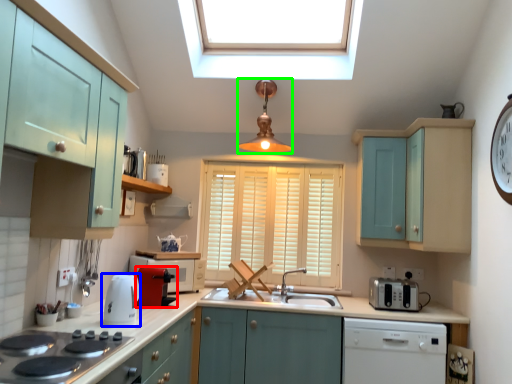
Question: Which is farther away from coffee machine (highlighted by a red box)? kitchen appliance (highlighted by a blue box) or light fixture (highlighted by a green box)?

Choices:
 (A) kitchen appliance
 (B) light fixture

Answer: (B)